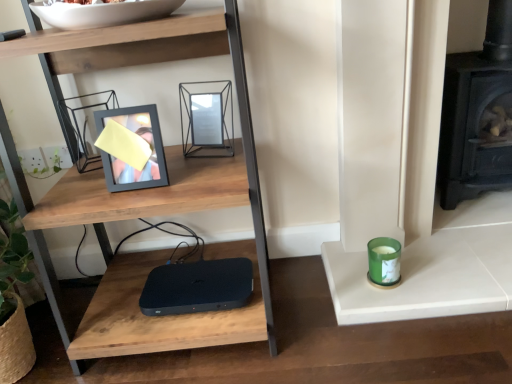
Question: Would you consider black cast iron fireplace at right to be distant from white glossy bowl at upper center?

Choices:
 (A) yes
 (B) no

Answer: (A)

Question: Is black cast iron fireplace at right next to white glossy bowl at upper center and touching it?

Choices:
 (A) no
 (B) yes

Answer: (A)

Question: Is black cast iron fireplace at right oriented towards white glossy bowl at upper center?

Choices:
 (A) yes
 (B) no

Answer: (B)

Question: Does black cast iron fireplace at right have a greater width compared to white glossy bowl at upper center?

Choices:
 (A) no
 (B) yes

Answer: (A)

Question: Is black cast iron fireplace at right at the right side of white glossy bowl at upper center?

Choices:
 (A) no
 (B) yes

Answer: (B)

Question: From a real-world perspective, is black cast iron fireplace at right physically located above or below woodenmaterial/textureshelf at center?

Choices:
 (A) above
 (B) below

Answer: (B)

Question: In the image, is black cast iron fireplace at right positioned in front of or behind woodenmaterial/textureshelf at center?

Choices:
 (A) behind
 (B) front

Answer: (A)

Question: Is point (492, 84) closer or farther from the camera than point (128, 56)?

Choices:
 (A) farther
 (B) closer

Answer: (A)

Question: Considering the relative positions of black cast iron fireplace at right and woodenmaterial/textureshelf at center in the image provided, is black cast iron fireplace at right to the left or to the right of woodenmaterial/textureshelf at center?

Choices:
 (A) right
 (B) left

Answer: (A)

Question: Choose the correct answer: Is matte black picture frame at upper left, marked as the first picture frame in a left-to-right arrangement, inside woodenmaterial/textureshelf at center or outside it?

Choices:
 (A) outside
 (B) inside

Answer: (B)

Question: Visually, is matte black picture frame at upper left, marked as the first picture frame in a left-to-right arrangement, positioned to the left or to the right of woodenmaterial/textureshelf at center?

Choices:
 (A) left
 (B) right

Answer: (A)

Question: Is matte black picture frame at upper left, which appears as the second picture frame when viewed from the right, taller or shorter than woodenmaterial/textureshelf at center?

Choices:
 (A) tall
 (B) short

Answer: (B)

Question: Is matte black picture frame at upper left, marked as the first picture frame in a left-to-right arrangement, wider or thinner than woodenmaterial/textureshelf at center?

Choices:
 (A) thin
 (B) wide

Answer: (A)

Question: Considering the positions of green glass candle at right and black cast iron fireplace at right in the image, is green glass candle at right taller or shorter than black cast iron fireplace at right?

Choices:
 (A) tall
 (B) short

Answer: (B)

Question: Is green glass candle at right in front of or behind black cast iron fireplace at right in the image?

Choices:
 (A) behind
 (B) front

Answer: (B)